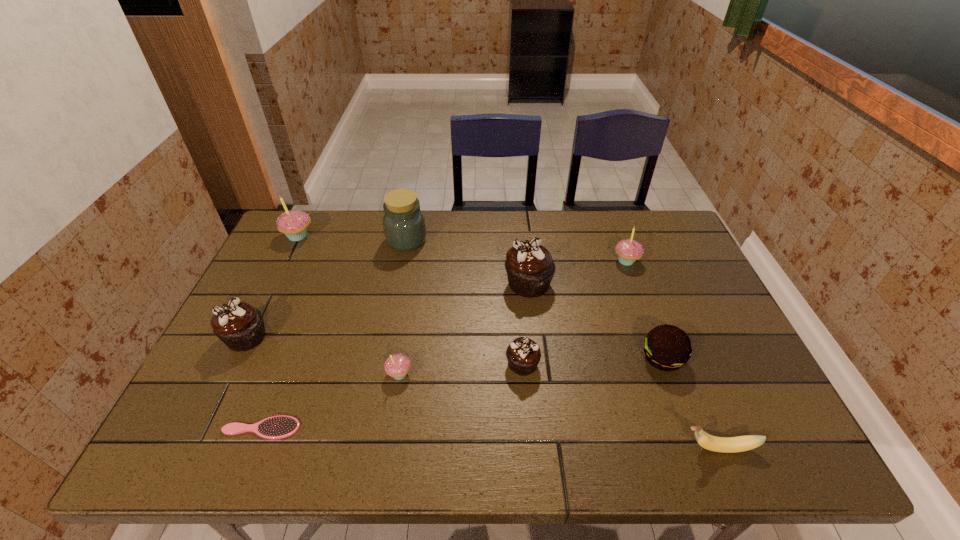
I want to click on vacant point located on the back of the patty, so click(640, 300).

Find the location of `free space located on the back of the second pink cupcake from left to right`. free space located on the back of the second pink cupcake from left to right is located at coordinates [411, 302].

The image size is (960, 540). I want to click on vacant space located on the left of the smallest brown cupcake, so click(x=433, y=364).

The height and width of the screenshot is (540, 960). I want to click on free space located at the stem of the nearest object, so click(x=651, y=448).

This screenshot has height=540, width=960. Identify the location of vacant region located at the stem of the nearest object. (656, 448).

Locate an element on the screen. Image resolution: width=960 pixels, height=540 pixels. vacant space positioned 0.240m at the stem of the nearest object is located at coordinates (566, 448).

Locate an element on the screen. This screenshot has height=540, width=960. blank space located on the right of the shortest object is located at coordinates (435, 428).

Where is `jar positioned at the far edge`? This screenshot has width=960, height=540. jar positioned at the far edge is located at coordinates (404, 226).

You are a GUI agent. You are given a task and a screenshot of the screen. Output one action in this format:
    pyautogui.click(x=<x>, y=<y>)
    Task: Click on the banana that is at the near edge
    Image resolution: width=960 pixels, height=540 pixels.
    Given the screenshot: What is the action you would take?
    pyautogui.click(x=740, y=443)

The width and height of the screenshot is (960, 540). I want to click on hairbrush present at the near edge, so click(x=275, y=427).